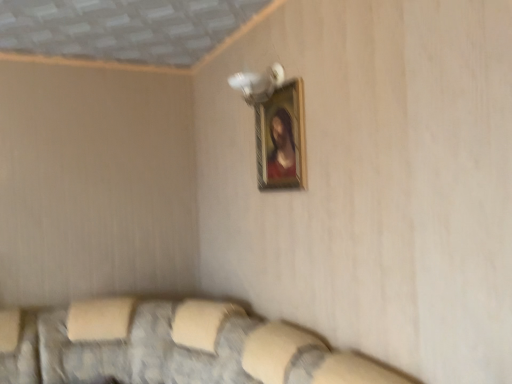
Question: In terms of height, does textured fabric couch at lower center look taller or shorter compared to wooden frame at upper center?

Choices:
 (A) tall
 (B) short

Answer: (A)

Question: From the image's perspective, is textured fabric couch at lower center above or below wooden frame at upper center?

Choices:
 (A) above
 (B) below

Answer: (B)

Question: Is textured fabric couch at lower center bigger or smaller than wooden frame at upper center?

Choices:
 (A) big
 (B) small

Answer: (A)

Question: Is wooden frame at upper center taller or shorter than textured fabric couch at lower center?

Choices:
 (A) tall
 (B) short

Answer: (B)

Question: Is wooden frame at upper center inside the boundaries of textured fabric couch at lower center, or outside?

Choices:
 (A) outside
 (B) inside

Answer: (A)

Question: Considering their positions, is wooden frame at upper center located in front of or behind textured fabric couch at lower center?

Choices:
 (A) front
 (B) behind

Answer: (B)

Question: In the image, is wooden frame at upper center on the left side or the right side of textured fabric couch at lower center?

Choices:
 (A) left
 (B) right

Answer: (B)